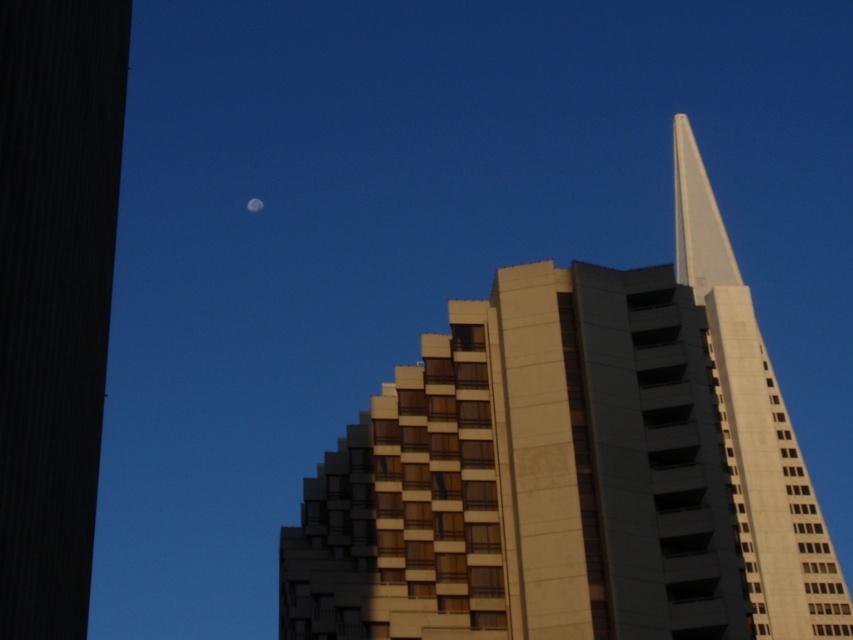
Who is taller, beige concrete building at center or silvery reflective moon at upper center?

beige concrete building at center

Is beige concrete building at center thinner than silvery reflective moon at upper center?

Incorrect, beige concrete building at center's width is not less than silvery reflective moon at upper center's.

Is point (527, 588) more distant than point (250, 209)?

That is False.

Where is `beige concrete building at center`? beige concrete building at center is located at coordinates (570, 480).

Is beige concrete building at center bigger than white smooth spire at upper right?

No.

You are a GUI agent. You are given a task and a screenshot of the screen. Output one action in this format:
    pyautogui.click(x=<x>, y=<y>)
    Task: Click on the beige concrete building at center
    This screenshot has width=853, height=640.
    Given the screenshot: What is the action you would take?
    pyautogui.click(x=570, y=480)

Does point (606, 628) come farther from viewer compared to point (694, 147)?

No, it is in front of (694, 147).

This screenshot has height=640, width=853. Find the location of `beige concrete building at center`. beige concrete building at center is located at coordinates (570, 480).

Can you confirm if white smooth spire at upper right is positioned below silvery reflective moon at upper center?

Indeed, white smooth spire at upper right is positioned under silvery reflective moon at upper center.

How much distance is there between white smooth spire at upper right and silvery reflective moon at upper center?

A distance of 149.17 meters exists between white smooth spire at upper right and silvery reflective moon at upper center.

You are a GUI agent. You are given a task and a screenshot of the screen. Output one action in this format:
    pyautogui.click(x=<x>, y=<y>)
    Task: Click on the white smooth spire at upper right
    The width and height of the screenshot is (853, 640).
    Given the screenshot: What is the action you would take?
    pyautogui.click(x=697, y=220)

You are a GUI agent. You are given a task and a screenshot of the screen. Output one action in this format:
    pyautogui.click(x=<x>, y=<y>)
    Task: Click on the white smooth spire at upper right
    
    Given the screenshot: What is the action you would take?
    (697, 220)